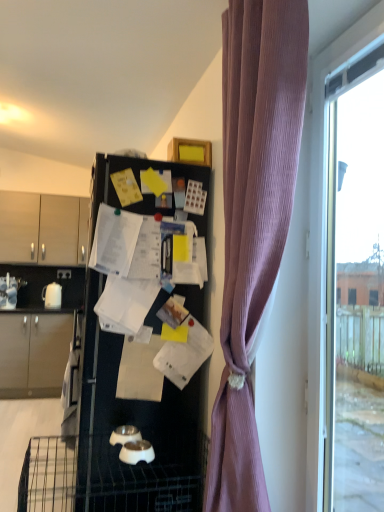
At what (x,y) coordinates should I click in order to perform the action: click on free space above transparent glass window at right (from a real-world perspective). Please return your answer as a coordinate pair (x, y). Looking at the image, I should click on (349, 67).